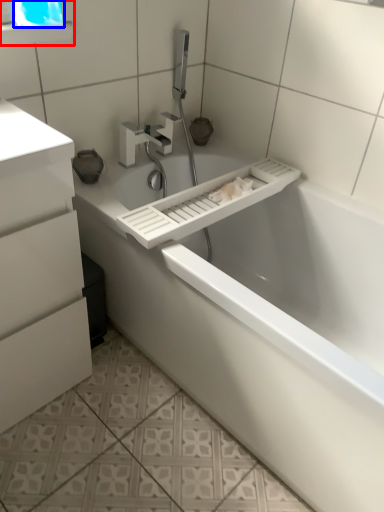
Question: Which object is further to the camera taking this photo, medicine cabinet (highlighted by a red box) or window screen (highlighted by a blue box)?

Choices:
 (A) medicine cabinet
 (B) window screen

Answer: (A)